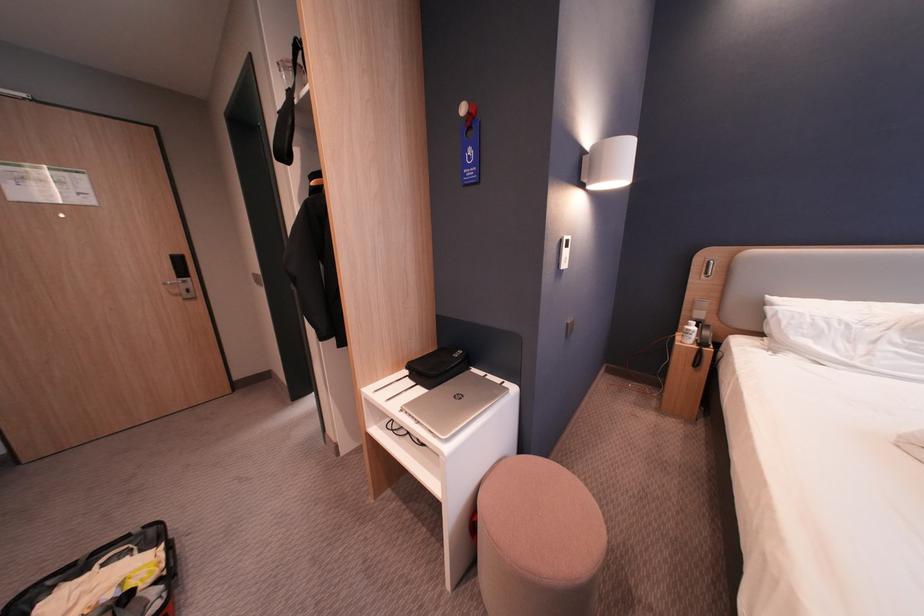
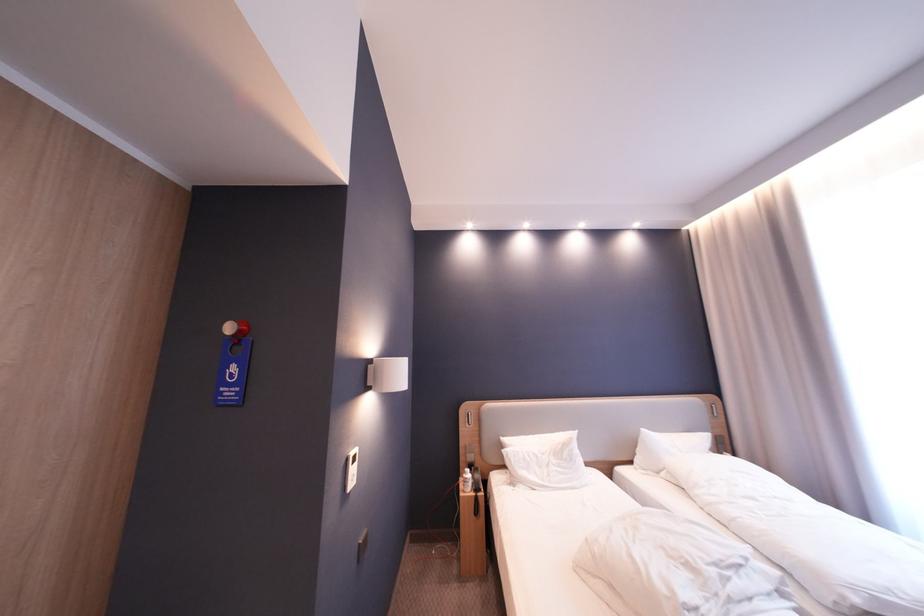
Where in the second image is the point corresponding to the point at 481,152 from the first image?

(245, 370)